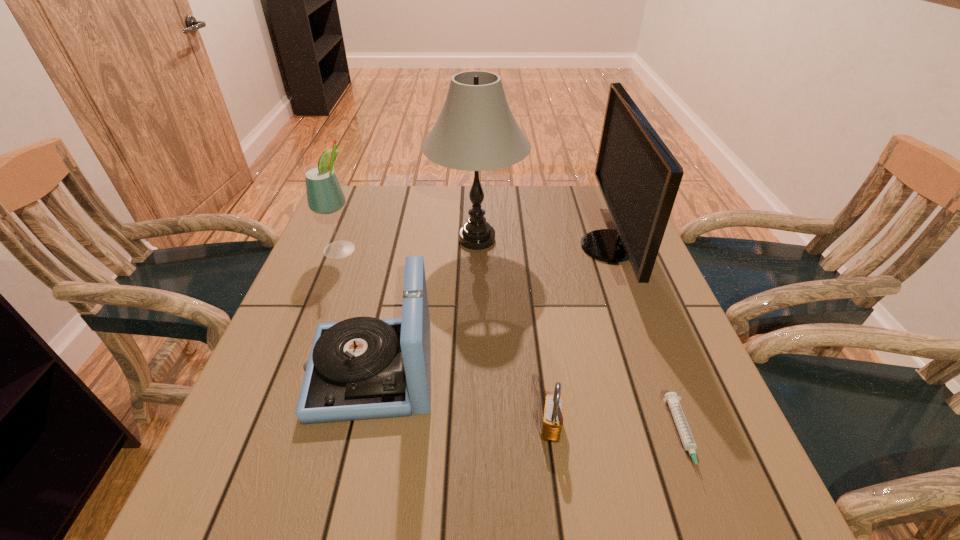
I want to click on the tallest object, so click(x=476, y=131).

At what (x,y) coordinates should I click in order to perform the action: click on computer monitor. Please return your answer as a coordinate pair (x, y). The width and height of the screenshot is (960, 540). Looking at the image, I should click on (639, 178).

In order to click on alcohol in this screenshot , I will do [x=324, y=194].

The height and width of the screenshot is (540, 960). Find the location of `phonograph record`. phonograph record is located at coordinates (362, 368).

Find the location of a particular element. padlock is located at coordinates [552, 423].

Where is `syringe`? syringe is located at coordinates (671, 398).

You are a GUI agent. You are given a task and a screenshot of the screen. Output one action in this format:
    pyautogui.click(x=<x>, y=<y>)
    Task: Click on the free region located on the front of the tallest object
    Image resolution: width=960 pixels, height=540 pixels.
    Given the screenshot: What is the action you would take?
    pyautogui.click(x=476, y=314)

Where is `free space located on the front-facing side of the computer monitor`? The width and height of the screenshot is (960, 540). free space located on the front-facing side of the computer monitor is located at coordinates (470, 247).

Find the location of a particular element. This screenshot has height=540, width=960. vacant space located 0.380m on the front-facing side of the computer monitor is located at coordinates (442, 247).

Image resolution: width=960 pixels, height=540 pixels. I want to click on vacant area situated 0.110m on the front-facing side of the computer monitor, so click(540, 247).